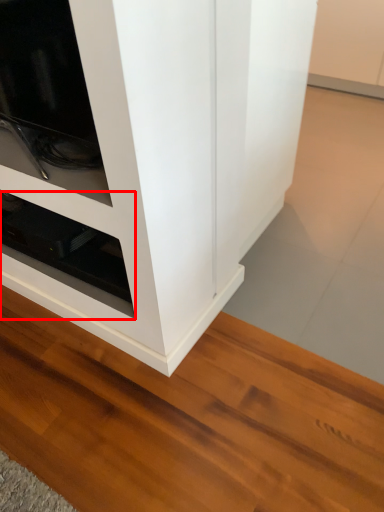
Question: From the image's perspective, where is shelf (annotated by the red box) located relative to cupboard?

Choices:
 (A) above
 (B) below

Answer: (B)